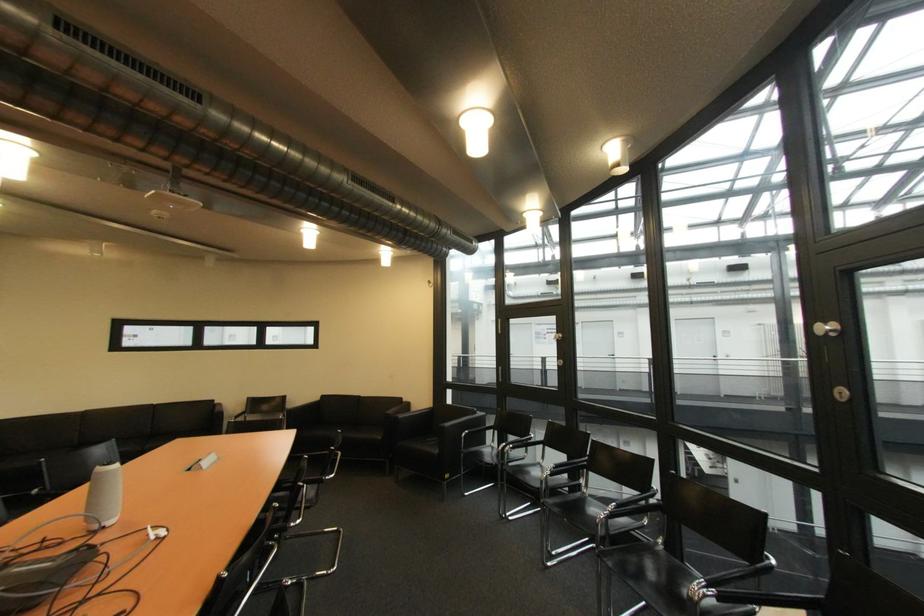
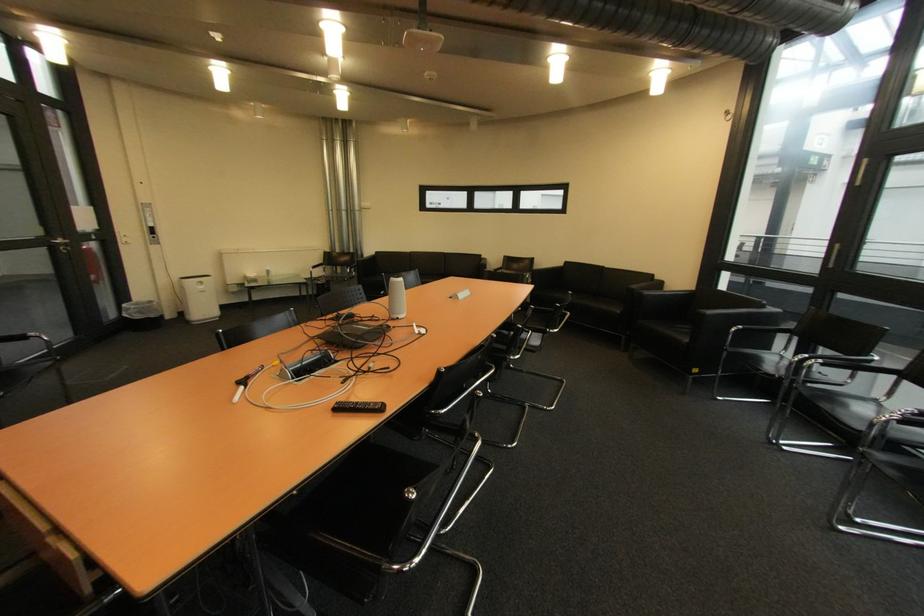
In the second image, find the point that corresponds to the point at 492,444 in the first image.

(775, 349)